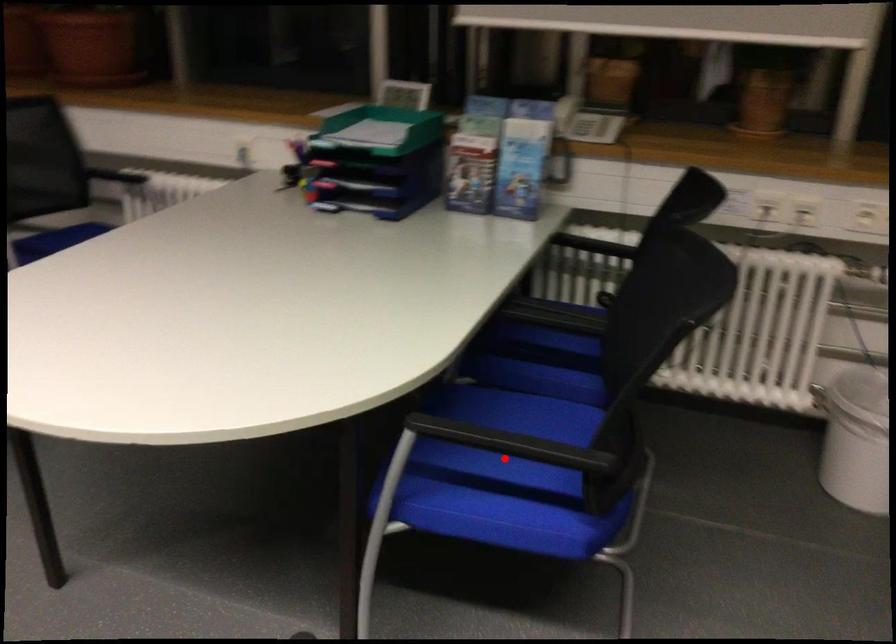
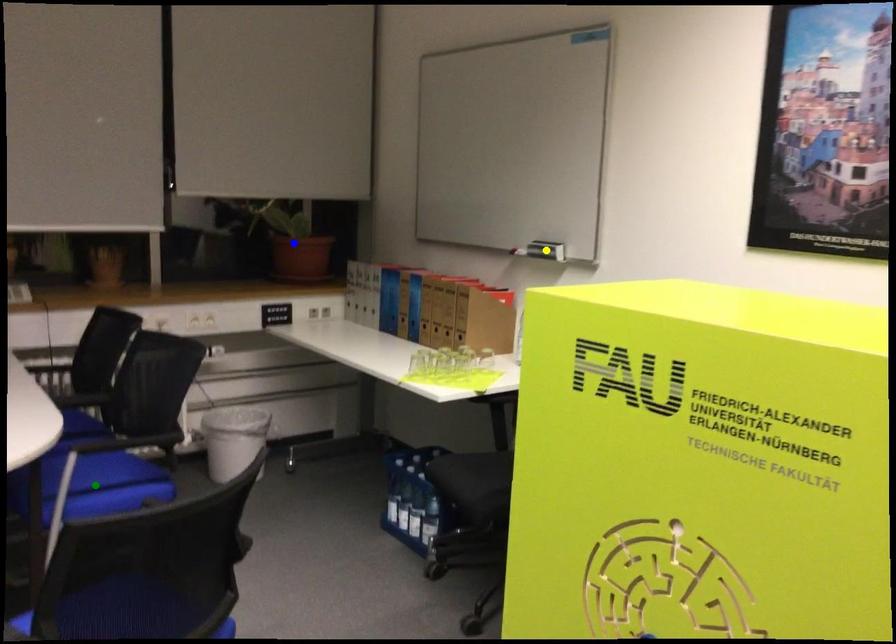
Question: I am providing you with two images of the same scene from different viewpoints. A red point is marked on the first image. You are given multiple points on the second image. Which point in image 2 represents the same 3d spot as the red point in image 1?

Choices:
 (A) blue point
 (B) green point
 (C) yellow point

Answer: (B)